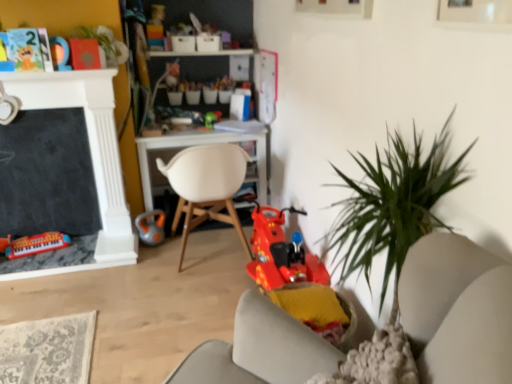
Question: From a real-world perspective, is green plastic toy at center, the 4th toy when ordered from bottom to top, above or below green leafy plant at upper left?

Choices:
 (A) above
 (B) below

Answer: (B)

Question: From the image's perspective, is green plastic toy at center, the second toy from the right, positioned above or below green leafy plant at upper left?

Choices:
 (A) below
 (B) above

Answer: (A)

Question: Based on their relative distances, which object is farther from the shiny plastic scooter at center, acting as the 5th toy starting from the left?

Choices:
 (A) green plastic toy at center, the 2th toy in the top-to-bottom sequence
 (B) orange rubber kettlebell at center, placed as the third toy when sorted from left to right
 (C) matte plastic keyboard at lower left, the first toy positioned from the bottom
 (D) matte plastic toy at upper left, the 2th toy from the left
 (E) green leafy plant at upper left

Answer: (D)

Question: Which object is the closest to the white matte chair at center?

Choices:
 (A) green plastic toy at center, the second toy from the right
 (B) matte plastic keyboard at lower left, the first toy positioned from the bottom
 (C) orange rubber kettlebell at center, the third toy positioned from the bottom
 (D) matte plastic toy at upper left, which is the fourth toy in right-to-left order
 (E) shiny plastic scooter at center, the second toy when ordered from bottom to top

Answer: (C)